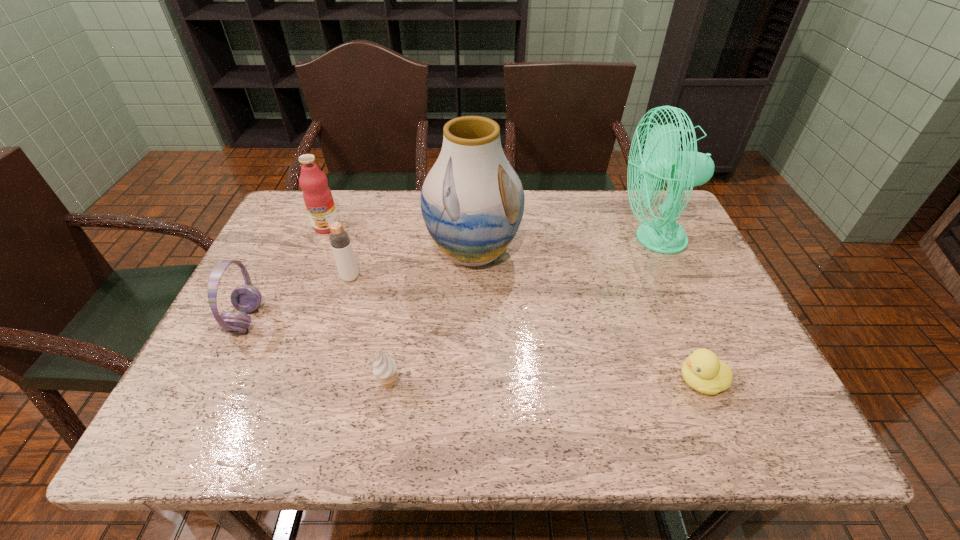
Identify the location of vacant space located 0.390m in front of the fan to blow air. This screenshot has width=960, height=540. (484, 239).

At what (x,y) coordinates should I click in order to perform the action: click on free space located 0.390m in front of the fan to blow air. Please return your answer as a coordinate pair (x, y). The width and height of the screenshot is (960, 540). Looking at the image, I should click on (484, 239).

Where is `vacant space situated 0.310m in front of the fan to blow air`? This screenshot has width=960, height=540. vacant space situated 0.310m in front of the fan to blow air is located at coordinates (513, 239).

Locate an element on the screen. The height and width of the screenshot is (540, 960). vacant area situated 0.100m on the back of the vase is located at coordinates (474, 204).

Identify the location of free region located 0.150m on the label of the third tallest object. The height and width of the screenshot is (540, 960). (309, 271).

Identify the location of free space located 0.200m on the left of the bottle. (263, 278).

Image resolution: width=960 pixels, height=540 pixels. I want to click on vacant area located 0.330m on the headband and ear cups of the headset, so tap(400, 319).

Locate an element on the screen. This screenshot has width=960, height=540. vacant point located 0.090m on the front-facing side of the fourth object from left to right is located at coordinates (380, 437).

Find the location of `vacant region located 0.270m at the beak of the shortest object`. vacant region located 0.270m at the beak of the shortest object is located at coordinates (545, 381).

Identify the location of vacant space located at the beak of the shortest object. (623, 381).